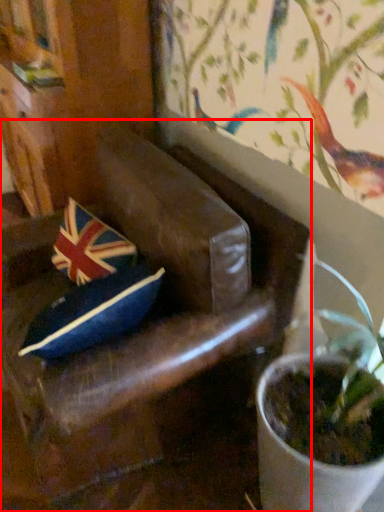
Question: From the image's perspective, where is chair (annotated by the red box) located relative to flag?

Choices:
 (A) below
 (B) above

Answer: (A)